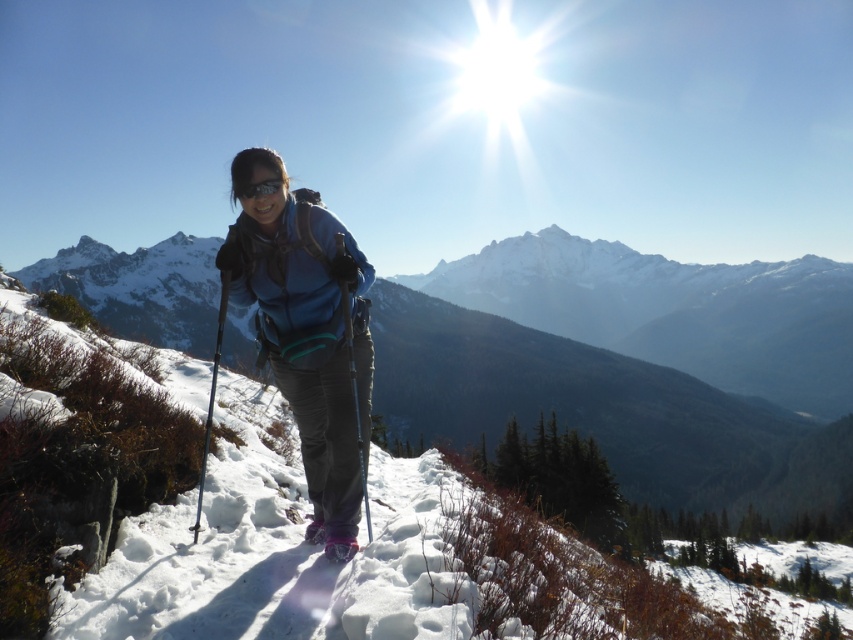
You are a photographer planning to take a picture of the blue fabric jacket at center and the matte black ski pole at center. Which object should you focus on first if you want to capture both in clear detail?

The blue fabric jacket at center is bigger than the matte black ski pole at center, so you should focus on the blue fabric jacket at center first to ensure it is in clear detail before adjusting for the smaller ski pole.